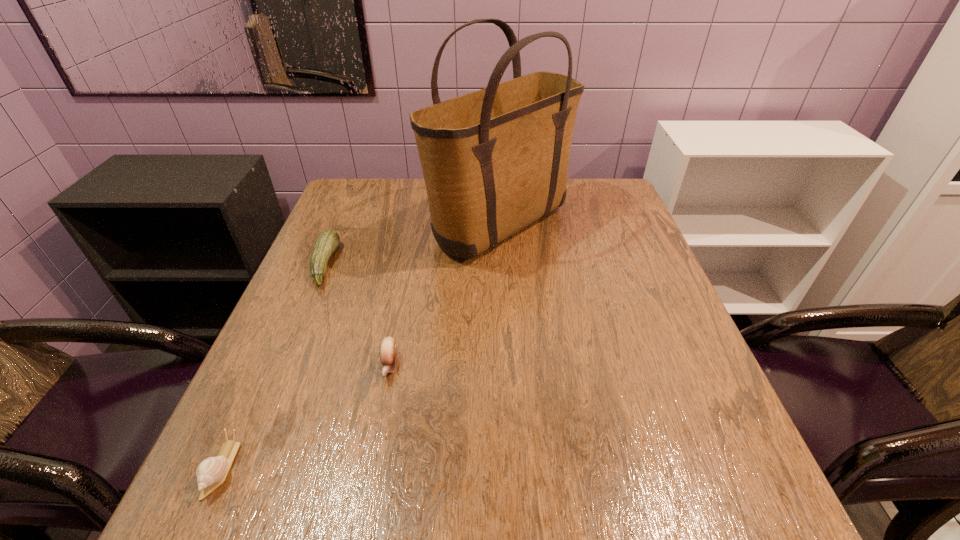
This screenshot has height=540, width=960. I want to click on tote bag, so click(495, 160).

What are the coordinates of `the rightmost object` in the screenshot? It's located at (495, 160).

At what (x,y) coordinates should I click in order to perform the action: click on zucchini. Please return your answer as a coordinate pair (x, y). This screenshot has height=540, width=960. Looking at the image, I should click on (328, 240).

The width and height of the screenshot is (960, 540). Find the location of `the third farthest object`. the third farthest object is located at coordinates (388, 350).

You are a GUI agent. You are given a task and a screenshot of the screen. Output one action in this format:
    pyautogui.click(x=<x>, y=<y>)
    Task: Click on the third object from left to right
    
    Given the screenshot: What is the action you would take?
    pyautogui.click(x=388, y=350)

The width and height of the screenshot is (960, 540). Identify the location of the left escargot. (211, 473).

Locate an element on the screen. the shortest object is located at coordinates (211, 473).

You are a GUI agent. You are given a task and a screenshot of the screen. Output one action in this format:
    pyautogui.click(x=<x>, y=<y>)
    Task: Click on the vacant area situated on the front of the rightmost object
    
    Given the screenshot: What is the action you would take?
    pyautogui.click(x=503, y=294)

Identify the location of vacant space located 0.110m at the stem end of the zucchini. tap(379, 264).

You are a GUI agent. You are given a task and a screenshot of the screen. Output one action in this format:
    pyautogui.click(x=<x>, y=<y>)
    Task: Click on the free space located 0.250m on the front-facing side of the second object from right to left
    
    Given the screenshot: What is the action you would take?
    pyautogui.click(x=358, y=526)